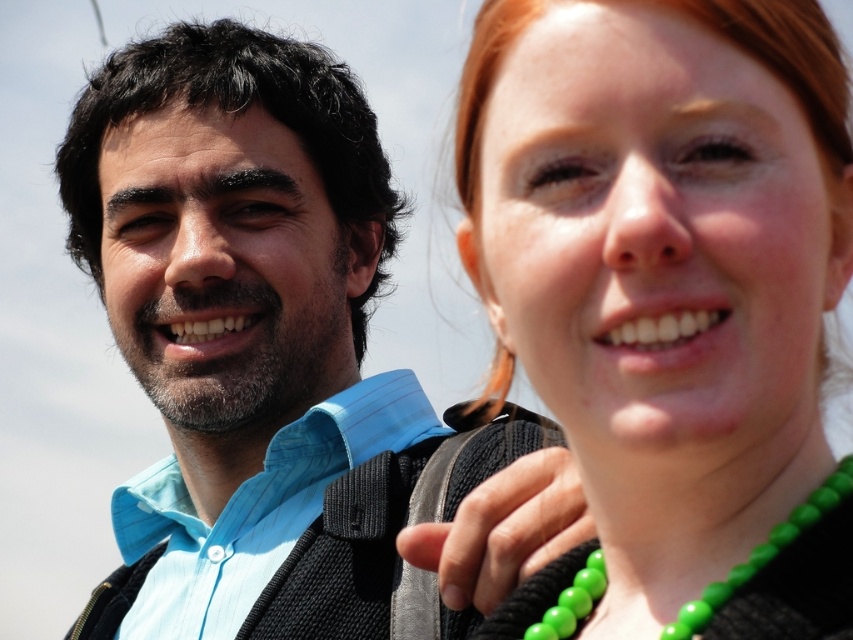
Can you confirm if blue striped shirt at left is positioned below green beads at center?

Actually, blue striped shirt at left is above green beads at center.

Who is more distant from viewer, (274, 216) or (670, 637)?

The point (274, 216) is behind.

Where is `blue striped shirt at left`? Image resolution: width=853 pixels, height=640 pixels. blue striped shirt at left is located at coordinates (236, 317).

Can you confirm if green beaded necklace at upper right is positioned below light blue striped shirt at left?

Actually, green beaded necklace at upper right is above light blue striped shirt at left.

Which is behind, point (821, 614) or point (299, 465)?

Positioned behind is point (299, 465).

This screenshot has height=640, width=853. I want to click on green beaded necklace at upper right, so click(x=660, y=280).

Between green beaded necklace at upper right and blue striped shirt at left, which one appears on the right side from the viewer's perspective?

Positioned to the right is green beaded necklace at upper right.

Does green beaded necklace at upper right appear over blue striped shirt at left?

Yes, green beaded necklace at upper right is above blue striped shirt at left.

Does point (776, 342) lie in front of point (263, 125)?

Yes, point (776, 342) is in front of point (263, 125).

Find the location of a particular element. The width and height of the screenshot is (853, 640). green beaded necklace at upper right is located at coordinates (660, 280).